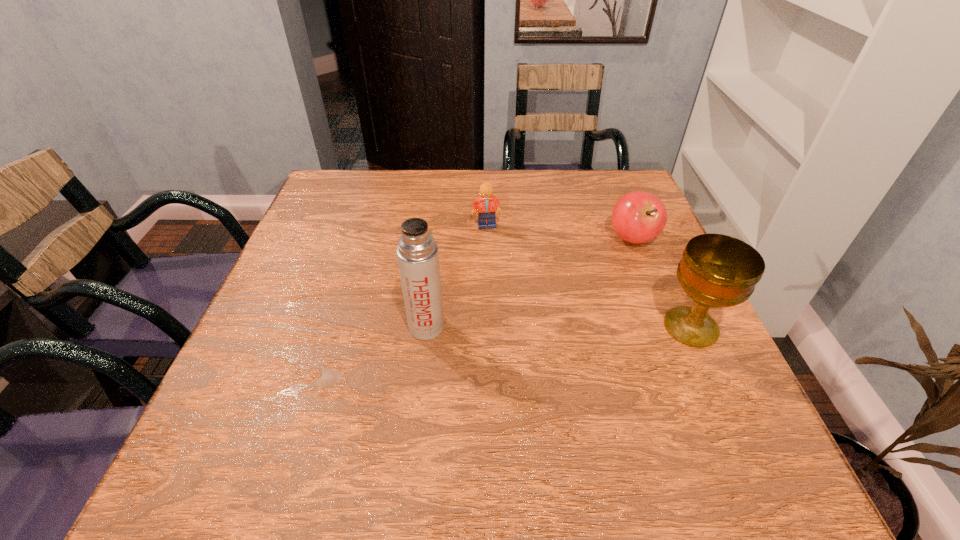
The width and height of the screenshot is (960, 540). What are the coordinates of `vacant spot on the desktop that is between the leftmost object and the chalice and is positioned on the front-facing side of the Lego` in the screenshot? It's located at (567, 327).

The width and height of the screenshot is (960, 540). I want to click on vacant space on the desktop that is between the leftmost object and the second tallest object and is positioned on the stem of the apple, so click(x=573, y=327).